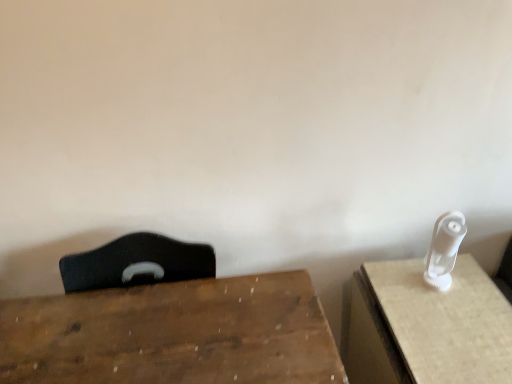
Question: Can you confirm if wooden table at center, which ranks as the 1th table in left-to-right order, is bigger than white plastic toothbrush at right, placed as the 1th table when sorted from right to left?

Choices:
 (A) yes
 (B) no

Answer: (A)

Question: Is wooden table at center, the 2th table positioned from the right, closer to camera compared to white plastic toothbrush at right, which appears as the second table when viewed from the left?

Choices:
 (A) yes
 (B) no

Answer: (A)

Question: From the image's perspective, does wooden table at center, the 2th table positioned from the right, appear lower than white plastic toothbrush at right, placed as the 1th table when sorted from right to left?

Choices:
 (A) yes
 (B) no

Answer: (B)

Question: Is wooden table at center, the 2th table positioned from the right, placed right next to white plastic toothbrush at right, placed as the 1th table when sorted from right to left?

Choices:
 (A) yes
 (B) no

Answer: (B)

Question: Can you confirm if wooden table at center, which ranks as the 1th table in left-to-right order, is thinner than white plastic toothbrush at right, which appears as the second table when viewed from the left?

Choices:
 (A) yes
 (B) no

Answer: (B)

Question: Is wooden table at center, the 2th table positioned from the right, inside the boundaries of white plastic toothbrush at right, which appears as the second table when viewed from the left, or outside?

Choices:
 (A) inside
 (B) outside

Answer: (B)

Question: Is wooden table at center, the 2th table positioned from the right, wider or thinner than white plastic toothbrush at right, placed as the 1th table when sorted from right to left?

Choices:
 (A) wide
 (B) thin

Answer: (A)

Question: Does point (154, 291) appear closer or farther from the camera than point (509, 314)?

Choices:
 (A) farther
 (B) closer

Answer: (A)

Question: In the image, is wooden table at center, which ranks as the 1th table in left-to-right order, on the left side or the right side of white plastic toothbrush at right, which appears as the second table when viewed from the left?

Choices:
 (A) right
 (B) left

Answer: (B)

Question: Considering the positions of point (292, 331) and point (438, 286), is point (292, 331) closer or farther from the camera than point (438, 286)?

Choices:
 (A) closer
 (B) farther

Answer: (A)

Question: From the image's perspective, is wooden table at center, which ranks as the 1th table in left-to-right order, positioned above or below white plastic wii controller at right?

Choices:
 (A) above
 (B) below

Answer: (B)

Question: Is wooden table at center, which ranks as the 1th table in left-to-right order, to the left or to the right of white plastic wii controller at right in the image?

Choices:
 (A) left
 (B) right

Answer: (A)

Question: Is wooden table at center, the 2th table positioned from the right, taller or shorter than white plastic wii controller at right?

Choices:
 (A) short
 (B) tall

Answer: (B)

Question: From a real-world perspective, is white plastic wii controller at right positioned above or below wooden table at center, which ranks as the 1th table in left-to-right order?

Choices:
 (A) above
 (B) below

Answer: (A)

Question: Considering the positions of point (448, 221) and point (173, 316), is point (448, 221) closer or farther from the camera than point (173, 316)?

Choices:
 (A) closer
 (B) farther

Answer: (B)